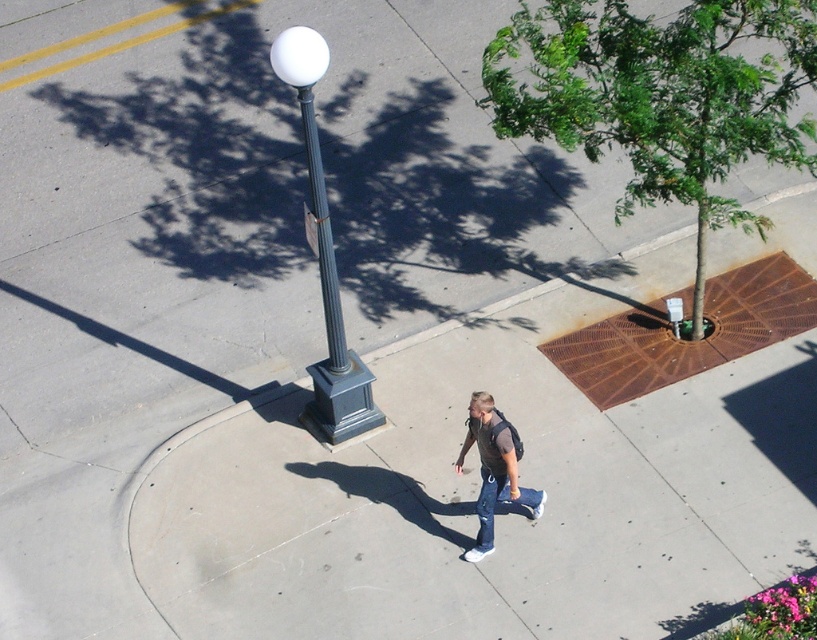
Can you confirm if denim jeans at center is smaller than metallic gray pole at center?

Indeed, denim jeans at center has a smaller size compared to metallic gray pole at center.

Who is more forward, [514,460] or [335,333]?

Point [514,460] is in front.

Find the location of a particular element. denim jeans at center is located at coordinates (494, 468).

Can you confirm if metallic gray pole at center is smaller than denim at center?

Actually, metallic gray pole at center might be larger than denim at center.

Can you confirm if metallic gray pole at center is taller than denim at center?

Yes, metallic gray pole at center is taller than denim at center.

Which is in front, point (337, 296) or point (499, 496)?

Point (499, 496)

Find the location of `metallic gray pole at center`. metallic gray pole at center is located at coordinates (324, 241).

Is point (463, 449) farther from camera compared to point (485, 488)?

Yes, it is behind point (485, 488).

How distant is denim jeans at center from denim at center?

The distance of denim jeans at center from denim at center is 4.11 inches.

Where is `denim jeans at center`? The width and height of the screenshot is (817, 640). denim jeans at center is located at coordinates (494, 468).